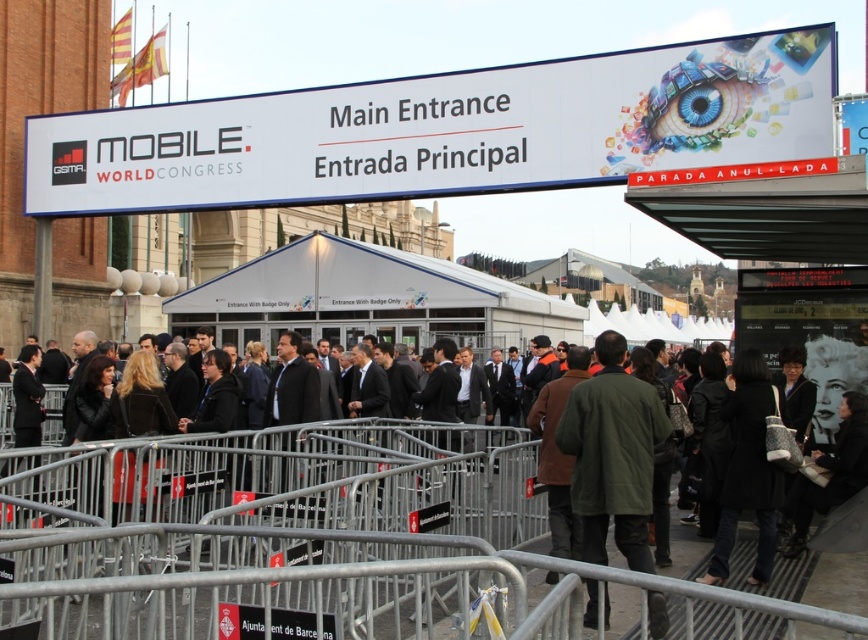
Question: Observing the image, what is the correct spatial positioning of white plastic sign at upper center in reference to dark brown leather jacket at center?

Choices:
 (A) right
 (B) left

Answer: (B)

Question: Considering the real-world distances, which object is farthest from the white fabric canopy at center?

Choices:
 (A) green matte jacket at center
 (B) white plastic sign at upper center

Answer: (A)

Question: Which point is closer to the camera?

Choices:
 (A) (754, 84)
 (B) (667, 420)
 (C) (487, 531)

Answer: (B)

Question: Does white fabric canopy at center appear on the left side of green matte jacket at center?

Choices:
 (A) no
 (B) yes

Answer: (B)

Question: Observing the image, what is the correct spatial positioning of white plastic sign at upper center in reference to white fabric canopy at center?

Choices:
 (A) right
 (B) left

Answer: (B)

Question: Which object is positioned closest to the white plastic sign at upper center?

Choices:
 (A) dark brown leather jacket at center
 (B) white fabric canopy at center

Answer: (B)